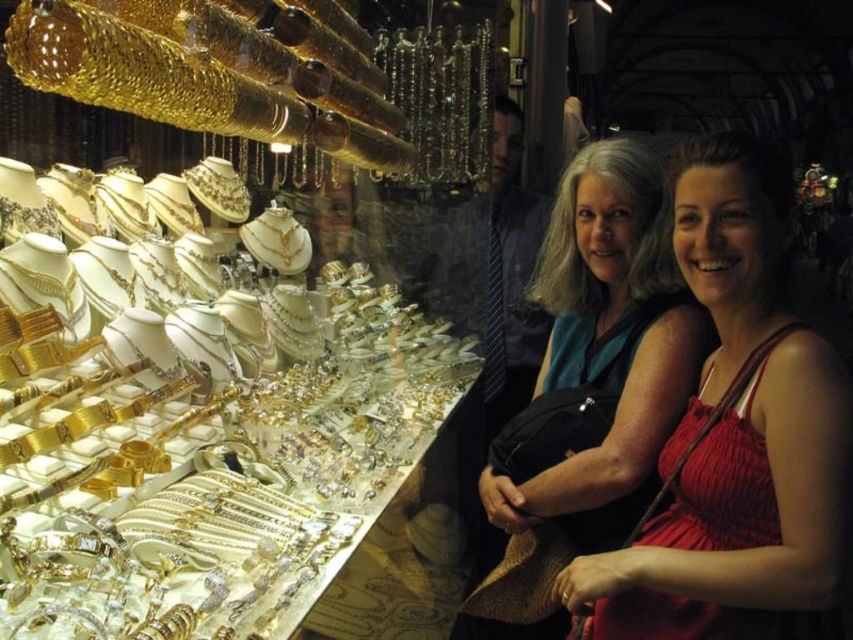
Is gold shiny jewelry at left smaller than matte red dress at center?

Incorrect, gold shiny jewelry at left is not smaller in size than matte red dress at center.

Between gold shiny jewelry at left and matte red dress at center, which one appears on the left side from the viewer's perspective?

Positioned to the left is gold shiny jewelry at left.

Who is more distant from viewer, (180,433) or (704,468)?

The point (180,433) is more distant.

Find the location of a particular element. This screenshot has height=640, width=853. gold shiny jewelry at left is located at coordinates (202, 429).

The height and width of the screenshot is (640, 853). What do you see at coordinates (202, 429) in the screenshot?
I see `gold shiny jewelry at left` at bounding box center [202, 429].

Does gold shiny jewelry at left have a larger size compared to matte teal dress at center?

Yes, gold shiny jewelry at left is bigger than matte teal dress at center.

The height and width of the screenshot is (640, 853). What are the coordinates of `gold shiny jewelry at left` in the screenshot? It's located at (202, 429).

Who is positioned more to the left, matte red dress at center or matte teal dress at center?

matte teal dress at center is more to the left.

Measure the distance between matte red dress at center and camera.

matte red dress at center and camera are 4.33 feet apart from each other.

Who is more distant from viewer, (830, 404) or (637, 481)?

Positioned behind is point (637, 481).

This screenshot has height=640, width=853. Identify the location of matte red dress at center. (735, 436).